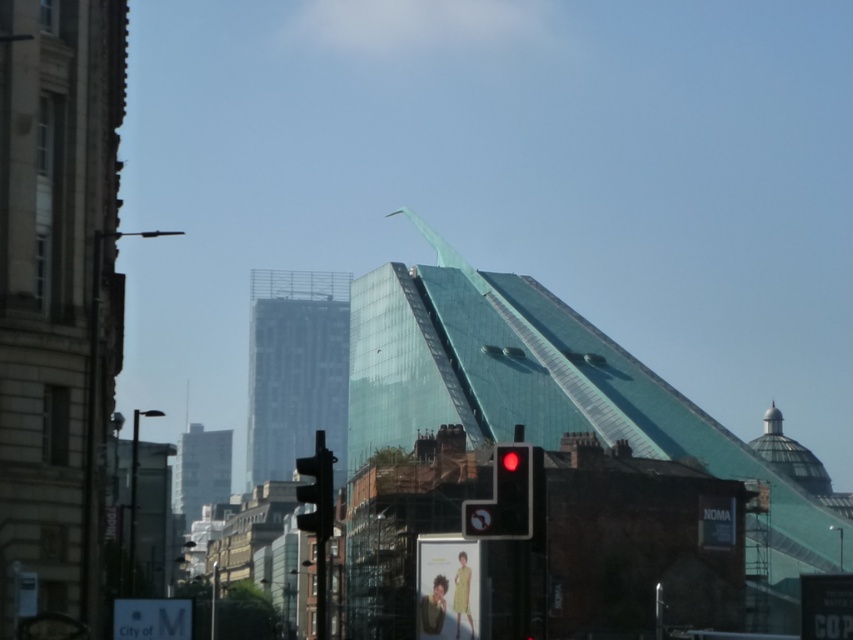
Is matte black traffic light at center smaller than red glass traffic light at center?

Incorrect, matte black traffic light at center is not smaller in size than red glass traffic light at center.

Is point (463, 525) in front of point (502, 522)?

No, (463, 525) is behind (502, 522).

Identify the location of matte black traffic light at center. The width and height of the screenshot is (853, 640). (503, 497).

Does point (523, 493) come behind point (321, 448)?

Yes, it is behind point (321, 448).

Which is more to the right, matte black traffic light at center or black plastic traffic light at center?

From the viewer's perspective, matte black traffic light at center appears more on the right side.

Is point (515, 460) positioned behind point (311, 524)?

Yes, it is behind point (311, 524).

Where is `matte black traffic light at center`? This screenshot has width=853, height=640. matte black traffic light at center is located at coordinates (503, 497).

Is red glass traffic light at center taller than black plastic traffic light at center?

In fact, red glass traffic light at center may be shorter than black plastic traffic light at center.

Does point (521, 468) come in front of point (306, 468)?

No, it is not.

Does point (515, 516) lie behind point (311, 474)?

Yes, point (515, 516) is farther from viewer.

What are the coordinates of `red glass traffic light at center` in the screenshot? It's located at (512, 492).